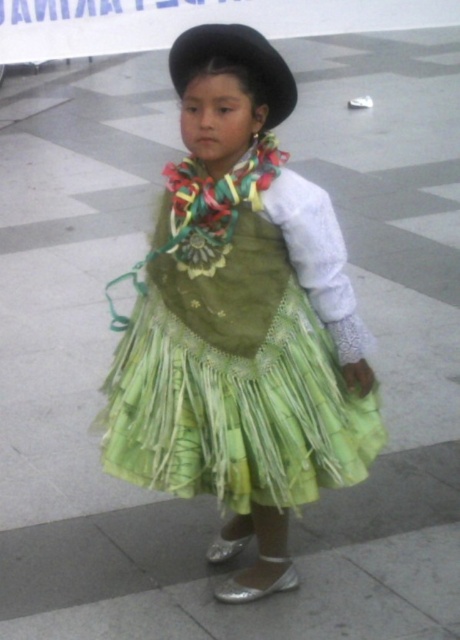
Does point (377, 435) lie behind point (245, 67)?

Yes, point (377, 435) is behind point (245, 67).

Who is more distant from viewer, (127, 364) or (288, 97)?

Point (127, 364)

I want to click on green woven dress at center, so click(x=230, y=356).